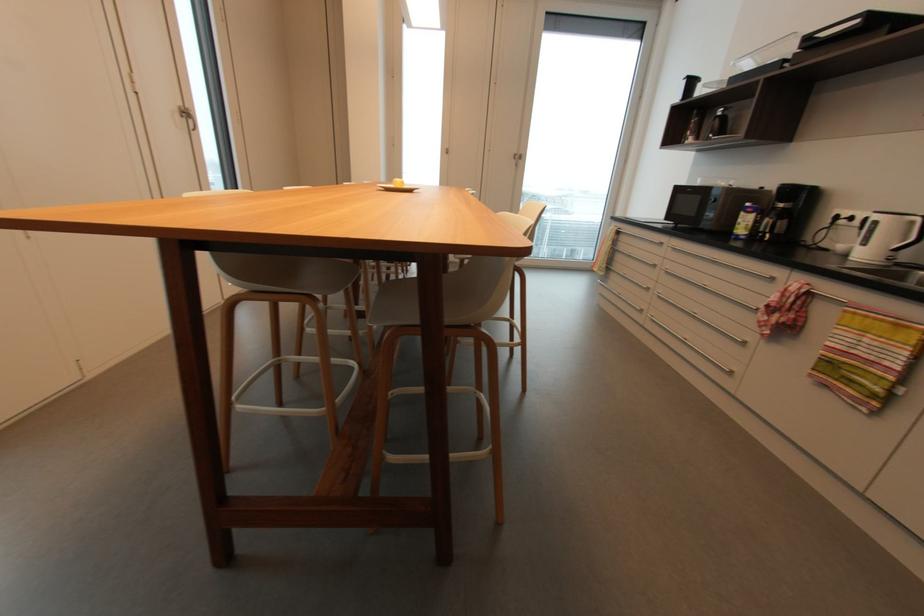
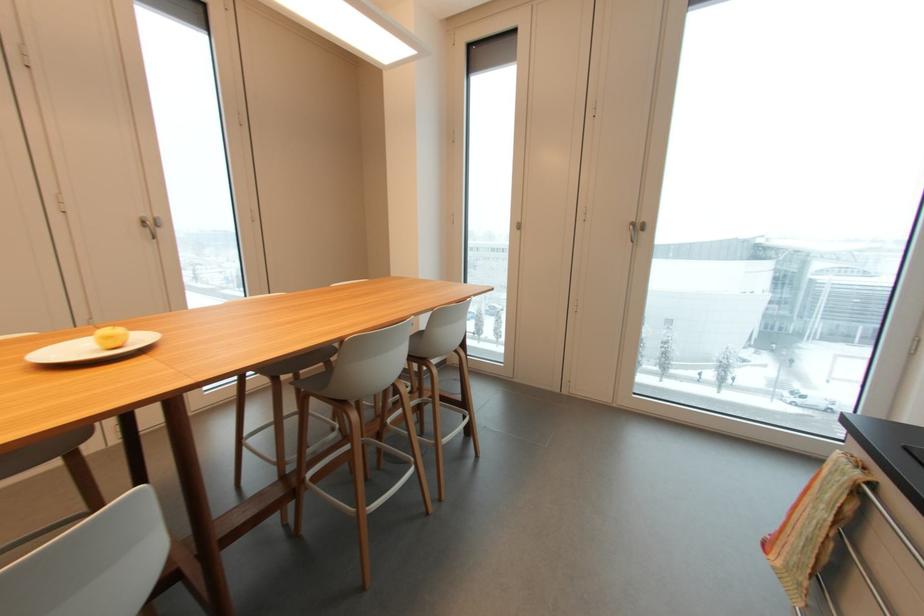
Find the pixel in the second image that matches point 183,108 in the first image.

(143, 217)